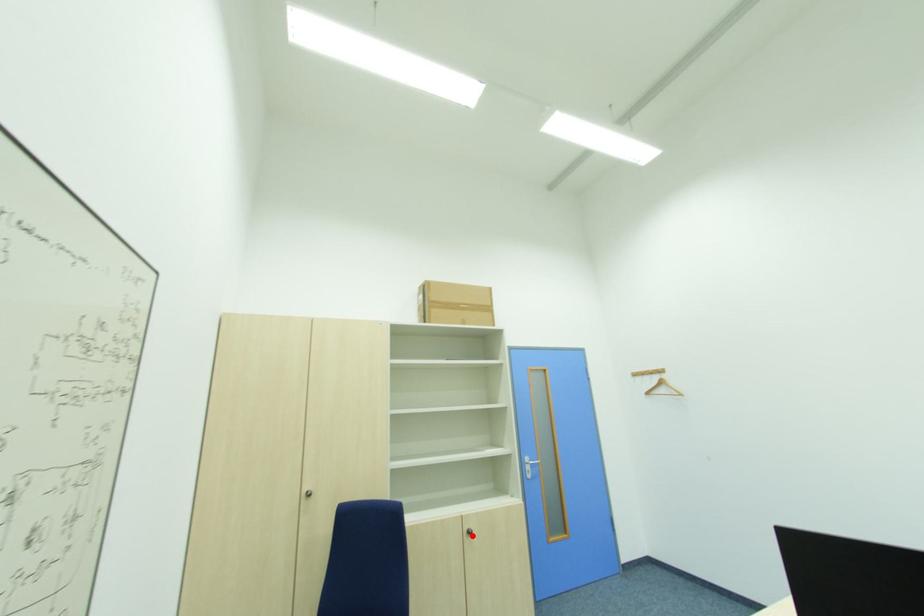
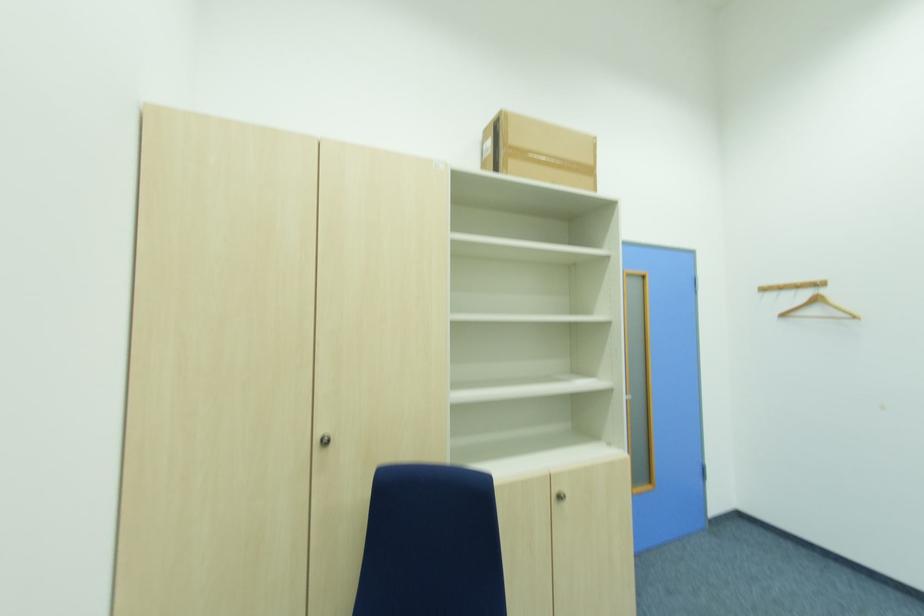
Where in the second image is the point corresponding to the highlighted location from the first image?

(564, 499)